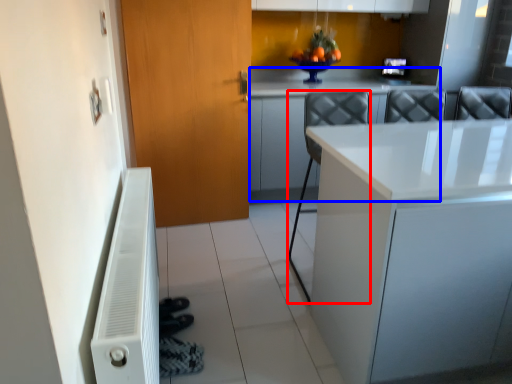
Question: Among these objects, which one is nearest to the camera, chair (highlighted by a red box) or counter top (highlighted by a blue box)?

Choices:
 (A) chair
 (B) counter top

Answer: (A)